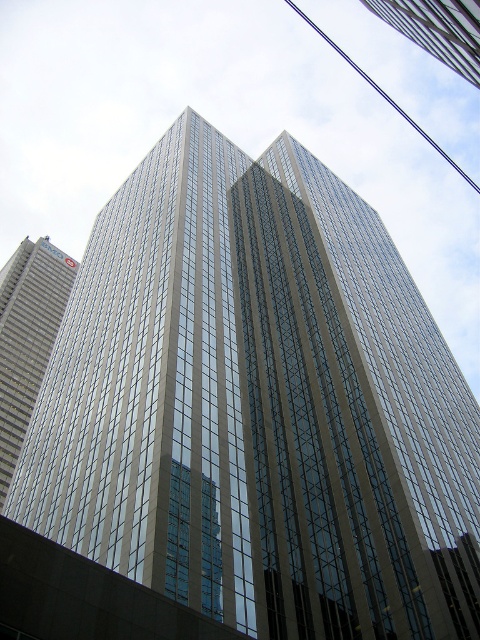
Is silver metallic skyscraper at left to the right of blue wire at upper center from the viewer's perspective?

Incorrect, silver metallic skyscraper at left is not on the right side of blue wire at upper center.

What do you see at coordinates (26, 337) in the screenshot?
I see `silver metallic skyscraper at left` at bounding box center [26, 337].

Is point (36, 262) closer to viewer compared to point (380, 90)?

Yes, it is in front of point (380, 90).

At what (x,y) coordinates should I click in order to perform the action: click on silver metallic skyscraper at left. Please return your answer as a coordinate pair (x, y). The width and height of the screenshot is (480, 640). Looking at the image, I should click on (26, 337).

Is silver metallic skyscraper at left above transparent glass skyscraper at upper center?

Incorrect, silver metallic skyscraper at left is not positioned above transparent glass skyscraper at upper center.

Is silver metallic skyscraper at left positioned before transparent glass skyscraper at upper center?

No, it is behind transparent glass skyscraper at upper center.

Who is more distant from viewer, (45,310) or (452,44)?

The point (45,310) is behind.

Where is `silver metallic skyscraper at left`? The height and width of the screenshot is (640, 480). silver metallic skyscraper at left is located at coordinates (26, 337).

This screenshot has width=480, height=640. Find the location of `transparent glass skyscraper at upper center`. transparent glass skyscraper at upper center is located at coordinates (437, 28).

Is point (472, 13) less distant than point (325, 38)?

Yes.

Find the location of a particular element. Image resolution: width=480 pixels, height=640 pixels. transparent glass skyscraper at upper center is located at coordinates (437, 28).